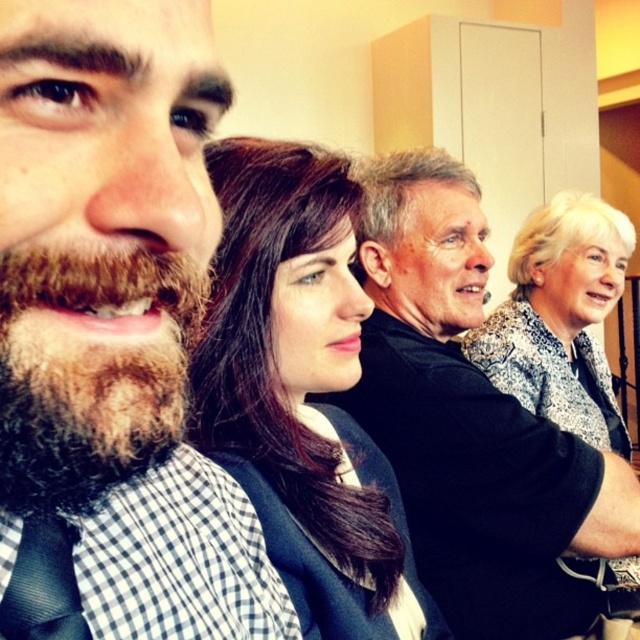
You are a photographer standing 10 feet away from the dark brown hair at center and brown fuzzy beard at left. You want to take a photo of both subjects without any overlap. Given that your camera has a maximum zoom range of 10x, can you do it?

The dark brown hair at center is 16.82 inches from the brown fuzzy beard at left. Since the photographer is 10 feet away, the distance between them in the frame would be approximately 2 inches at 10 feet. With a 10x zoom, the camera can magnify the image enough to separate them without overlap.